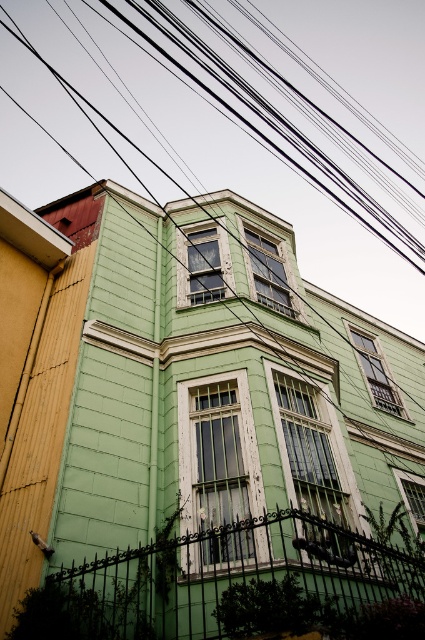
Who is higher up, white wooden window at center or matte glass window at upper center?

matte glass window at upper center is above.

Where is `white wooden window at center`? The image size is (425, 640). white wooden window at center is located at coordinates (218, 467).

The width and height of the screenshot is (425, 640). In order to click on green painted glass window at center in this screenshot , I will do `click(312, 461)`.

At what (x,y) coordinates should I click in order to perform the action: click on green painted glass window at center. Please return your answer as a coordinate pair (x, y). Looking at the image, I should click on (312, 461).

Can you confirm if green painted glass window at center is positioned below green matte window at center?

Incorrect, green painted glass window at center is not positioned below green matte window at center.

Between point (308, 464) and point (413, 515), which one is positioned behind?

Positioned behind is point (413, 515).

Which is in front, point (317, 410) or point (396, 477)?

Positioned in front is point (317, 410).

Find the location of a particular element. Image resolution: width=425 pixels, height=640 pixels. green painted glass window at center is located at coordinates (312, 461).